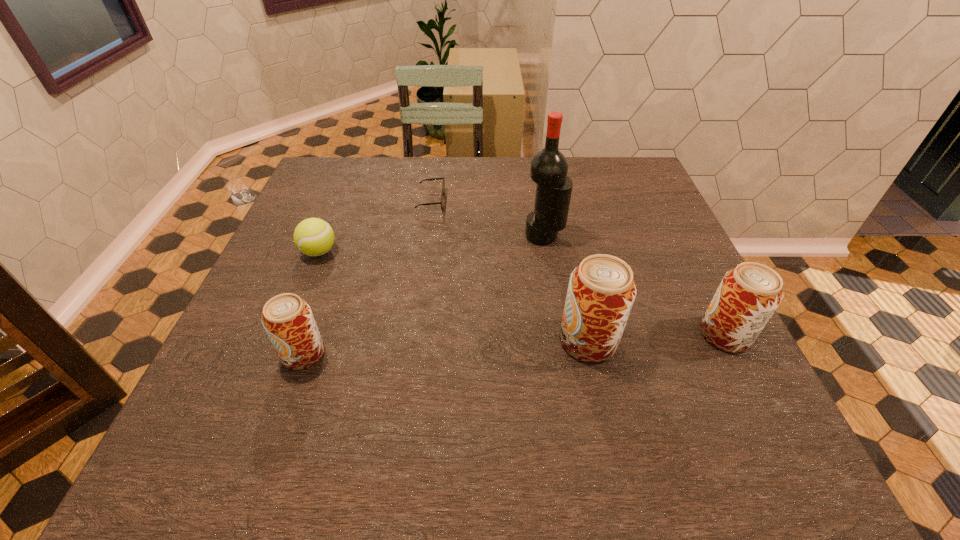
Image resolution: width=960 pixels, height=540 pixels. Find the location of `the shortest beer can`. the shortest beer can is located at coordinates (287, 319).

The image size is (960, 540). What are the coordinates of `the fourth tallest object` in the screenshot? It's located at (287, 319).

Find the location of a particular element. the second beer can from right to left is located at coordinates (601, 292).

The image size is (960, 540). Find the location of `the fourth shortest object`. the fourth shortest object is located at coordinates (748, 295).

You are a GUI agent. You are given a task and a screenshot of the screen. Output one action in this format:
    pyautogui.click(x=<x>, y=<y>)
    Task: Click on the rightmost beer can
    This screenshot has width=960, height=540.
    Given the screenshot: What is the action you would take?
    pyautogui.click(x=748, y=295)

The height and width of the screenshot is (540, 960). I want to click on wine bottle, so click(549, 167).

I want to click on the second shortest object, so click(x=313, y=236).

Where is `the farthest object`? the farthest object is located at coordinates (443, 185).

This screenshot has width=960, height=540. Identify the location of the shortest object. (443, 185).

Locate an element on the screen. This screenshot has width=960, height=540. free space located 0.380m on the back of the third shortest object is located at coordinates (348, 224).